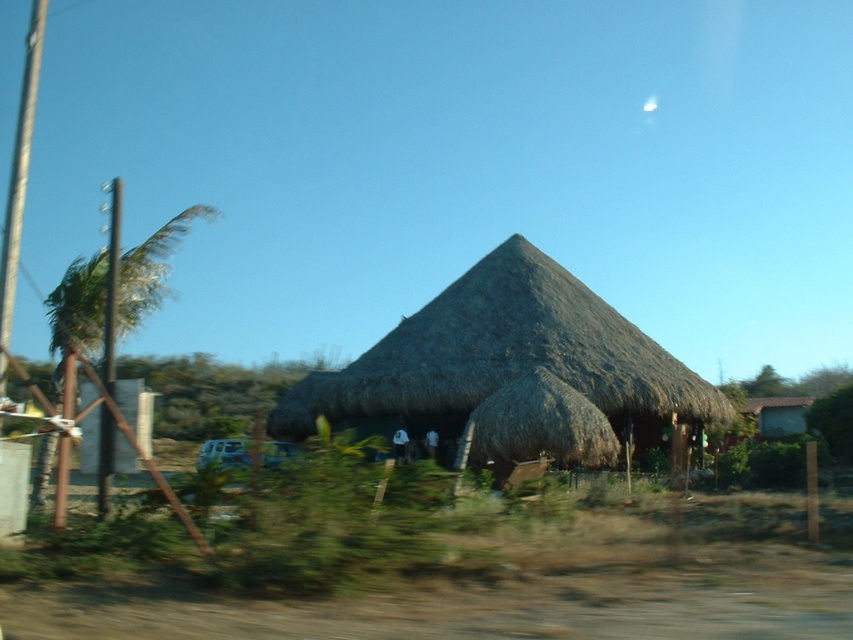
Question: Is thatched roof hut at center thinner than white matte car at lower left?

Choices:
 (A) yes
 (B) no

Answer: (B)

Question: Which point is closer to the camera?

Choices:
 (A) white matte car at lower left
 (B) metallic silver car window at center
 (C) thatched roof hut at center
 (D) transparent glass car window at center

Answer: (A)

Question: Does metallic pole at left appear over white matte car at lower left?

Choices:
 (A) yes
 (B) no

Answer: (A)

Question: Which point is closer to the camera taking this photo?

Choices:
 (A) (218, 445)
 (B) (498, 253)

Answer: (A)

Question: Which point appears closest to the camera in this image?

Choices:
 (A) (218, 458)
 (B) (115, 268)
 (C) (219, 442)
 (D) (578, 298)

Answer: (B)

Question: Is thatched roof hut at center further to camera compared to transparent glass car window at center?

Choices:
 (A) no
 (B) yes

Answer: (A)